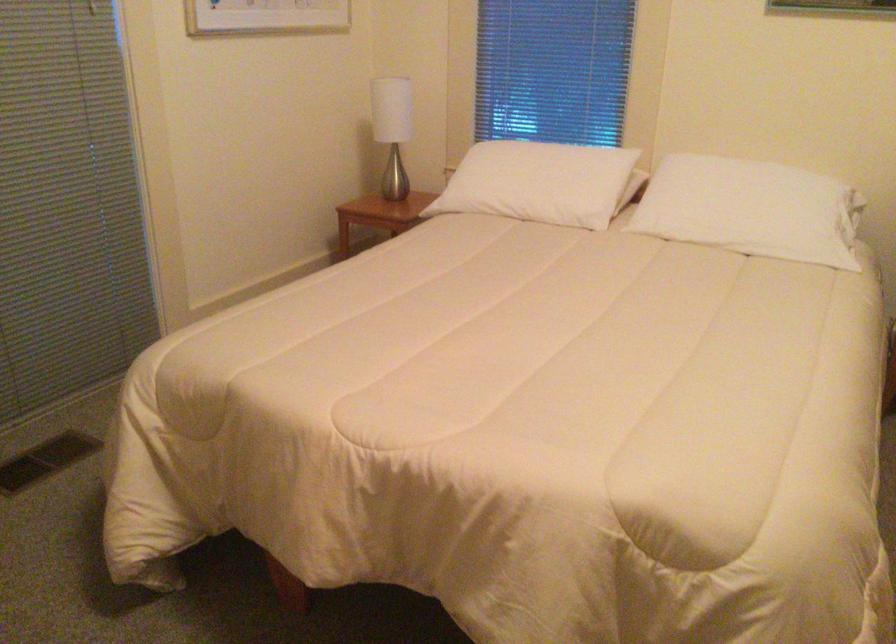
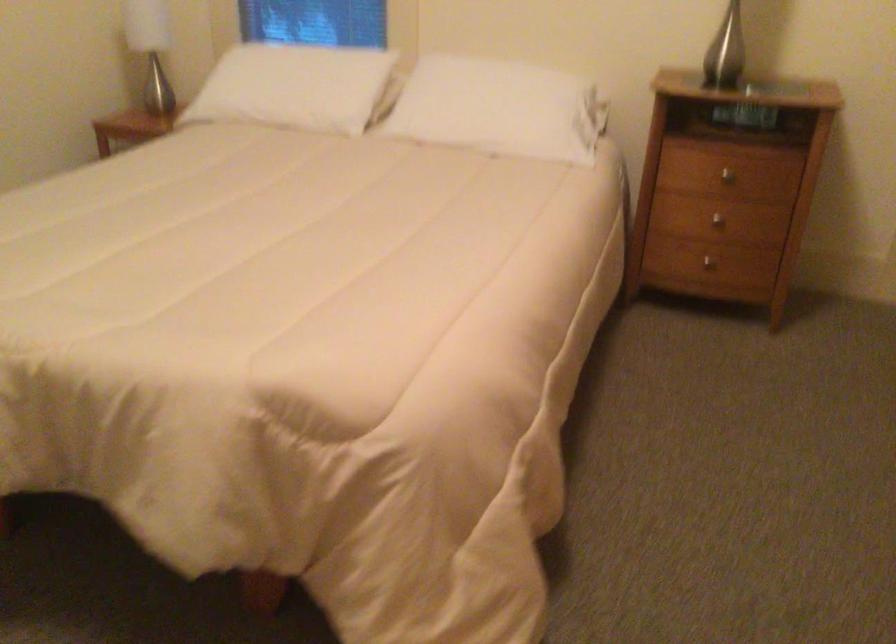
Question: In a continuous first-person perspective shot, in which direction is the camera moving?

Choices:
 (A) Left
 (B) Right
 (C) Forward
 (D) Backward

Answer: (B)